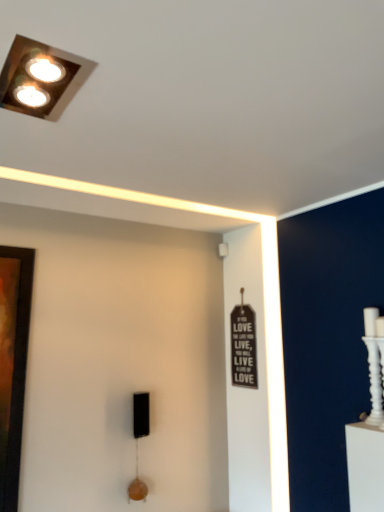
Question: Is white textured candle holder at right oriented towards metallic square light fixture at upper left?

Choices:
 (A) yes
 (B) no

Answer: (A)

Question: Is metallic square light fixture at upper left located within white textured candle holder at right?

Choices:
 (A) yes
 (B) no

Answer: (B)

Question: Can you confirm if white textured candle holder at right is wider than metallic square light fixture at upper left?

Choices:
 (A) yes
 (B) no

Answer: (B)

Question: Considering the relative sizes of white textured candle holder at right and metallic square light fixture at upper left in the image provided, is white textured candle holder at right thinner than metallic square light fixture at upper left?

Choices:
 (A) yes
 (B) no

Answer: (A)

Question: Is white textured candle holder at right to the left of metallic square light fixture at upper left from the viewer's perspective?

Choices:
 (A) yes
 (B) no

Answer: (B)

Question: Is the surface of white textured candle holder at right in direct contact with metallic square light fixture at upper left?

Choices:
 (A) no
 (B) yes

Answer: (A)

Question: Considering the relative sizes of metallic square light fixture at upper left and white textured candle holder at right in the image provided, is metallic square light fixture at upper left bigger than white textured candle holder at right?

Choices:
 (A) no
 (B) yes

Answer: (A)

Question: From a real-world perspective, is metallic square light fixture at upper left on white textured candle holder at right?

Choices:
 (A) no
 (B) yes

Answer: (B)

Question: Considering the relative positions of metallic square light fixture at upper left and white textured candle holder at right in the image provided, is metallic square light fixture at upper left to the right of white textured candle holder at right from the viewer's perspective?

Choices:
 (A) yes
 (B) no

Answer: (B)

Question: Can you confirm if metallic square light fixture at upper left is positioned to the left of white textured candle holder at right?

Choices:
 (A) no
 (B) yes

Answer: (B)

Question: Is metallic square light fixture at upper left aimed at white textured candle holder at right?

Choices:
 (A) yes
 (B) no

Answer: (B)

Question: Is metallic square light fixture at upper left next to white textured candle holder at right?

Choices:
 (A) yes
 (B) no

Answer: (B)

Question: Looking at their shapes, would you say white textured candle holder at right is wider or thinner than metallic square light fixture at upper left?

Choices:
 (A) wide
 (B) thin

Answer: (B)